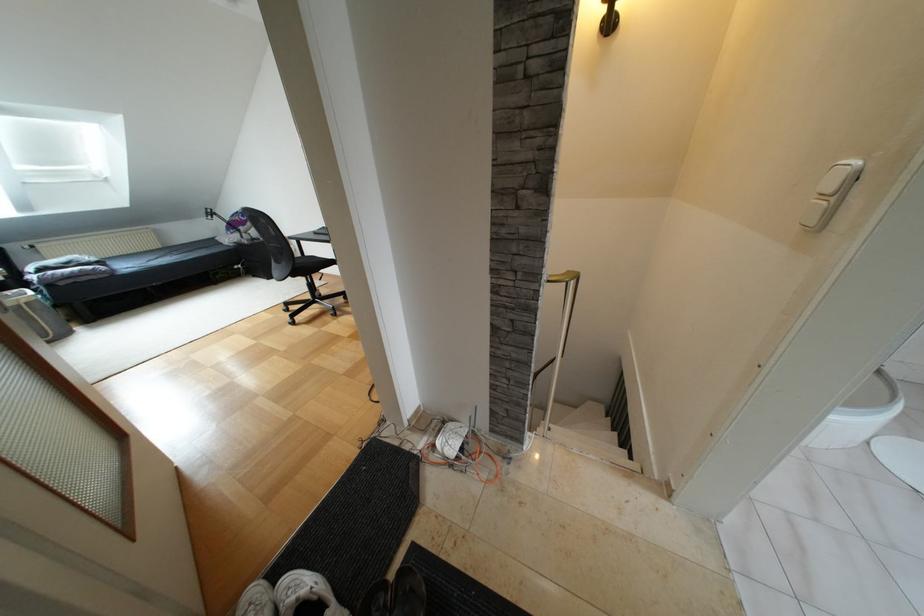
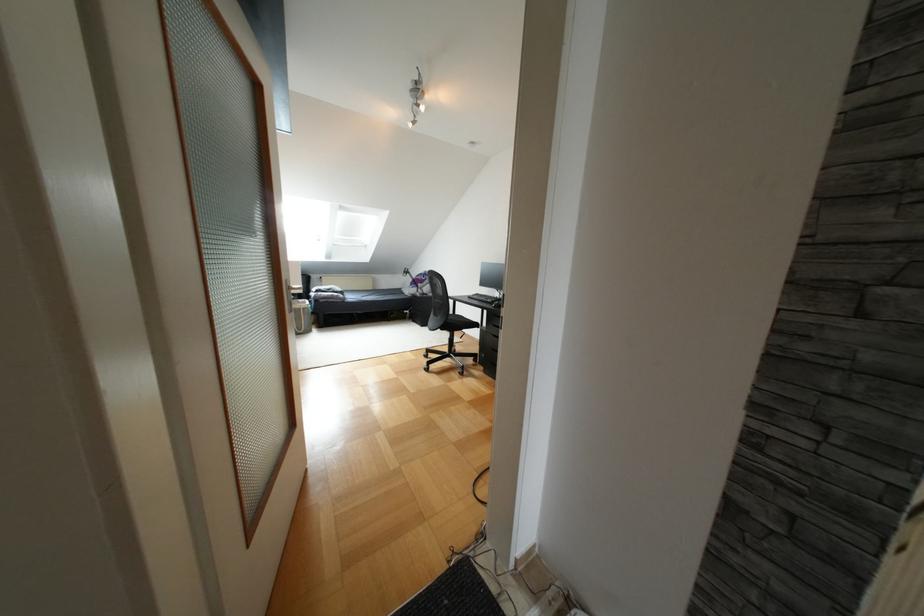
In the second image, find the point that corresponds to [210,241] in the first image.

(396, 290)